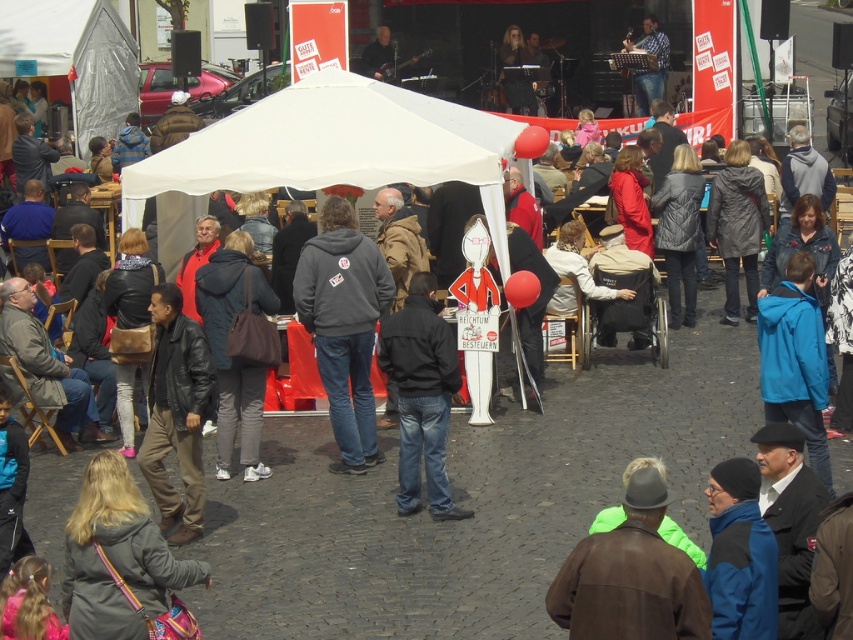
Question: Does white fabric tent at center have a smaller size compared to gray hoodie at center?

Choices:
 (A) no
 (B) yes

Answer: (B)

Question: Observing the image, what is the correct spatial positioning of white fabric tent at center in reference to dark blue jacket at center?

Choices:
 (A) below
 (B) above

Answer: (B)

Question: Does white fabric tent at center come behind gray hoodie at center?

Choices:
 (A) no
 (B) yes

Answer: (B)

Question: Estimate the real-world distances between objects in this image. Which object is farther from the white fabric tent at center?

Choices:
 (A) brown leather jacket at lower right
 (B) black matte jacket at center

Answer: (A)

Question: Which of the following is the closest to the observer?

Choices:
 (A) pyautogui.click(x=207, y=273)
 (B) pyautogui.click(x=599, y=557)
 (C) pyautogui.click(x=355, y=264)
 (D) pyautogui.click(x=407, y=150)

Answer: (B)

Question: Estimate the real-world distances between objects in this image. Which object is farther from the brown leather jacket at lower right?

Choices:
 (A) black matte jacket at center
 (B) white fabric tent at center
 (C) gray hoodie at center

Answer: (B)